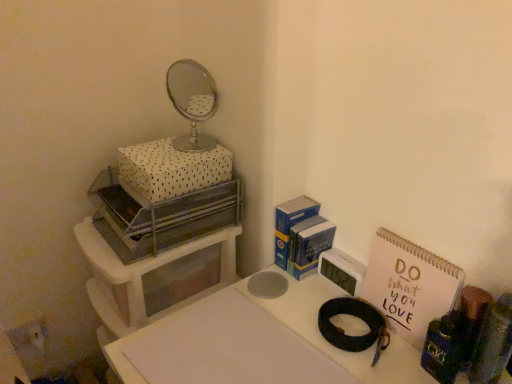
The height and width of the screenshot is (384, 512). Identify the location of free spot behind shiny metallic magnifying glass at upper center. (310, 291).